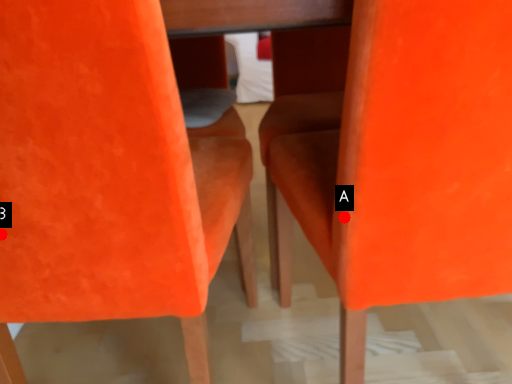
Question: Two points are circled on the image, labeled by A and B beside each circle. Which point is farther from the camera taking this photo?

Choices:
 (A) A is further
 (B) B is further

Answer: (A)